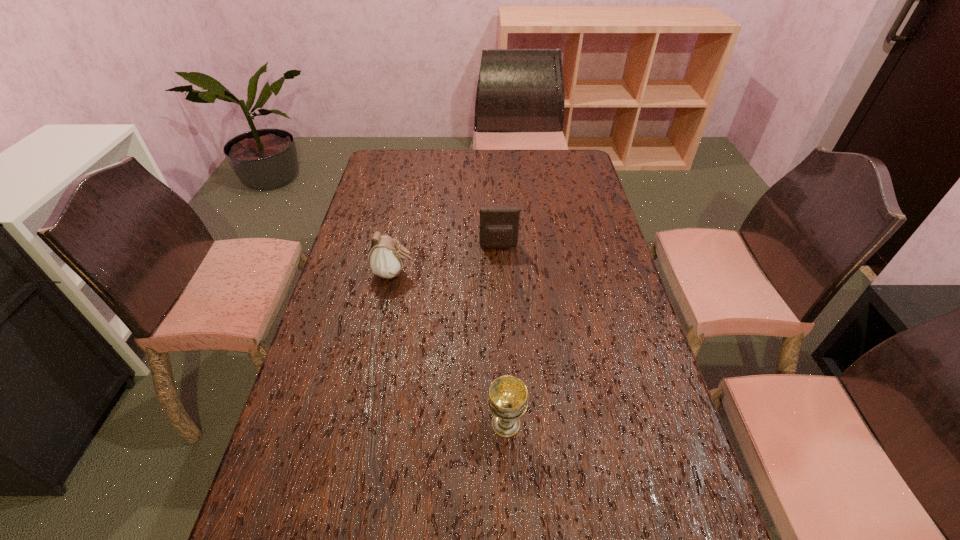
What are the coordinates of `free spot that satisfies the following two spatial constraints: 1. on the front-facing side of the chalice; 2. on the left side of the left pouch` in the screenshot? It's located at (363, 424).

Where is `vacant space that satisfies the following two spatial constraints: 1. on the front-facing side of the leftmost object; 2. on the left side of the nearest object`? This screenshot has height=540, width=960. vacant space that satisfies the following two spatial constraints: 1. on the front-facing side of the leftmost object; 2. on the left side of the nearest object is located at coordinates (363, 424).

Locate an element on the screen. The image size is (960, 540). vacant region that satisfies the following two spatial constraints: 1. on the front-facing side of the nearer pouch; 2. on the back side of the chalice is located at coordinates (363, 424).